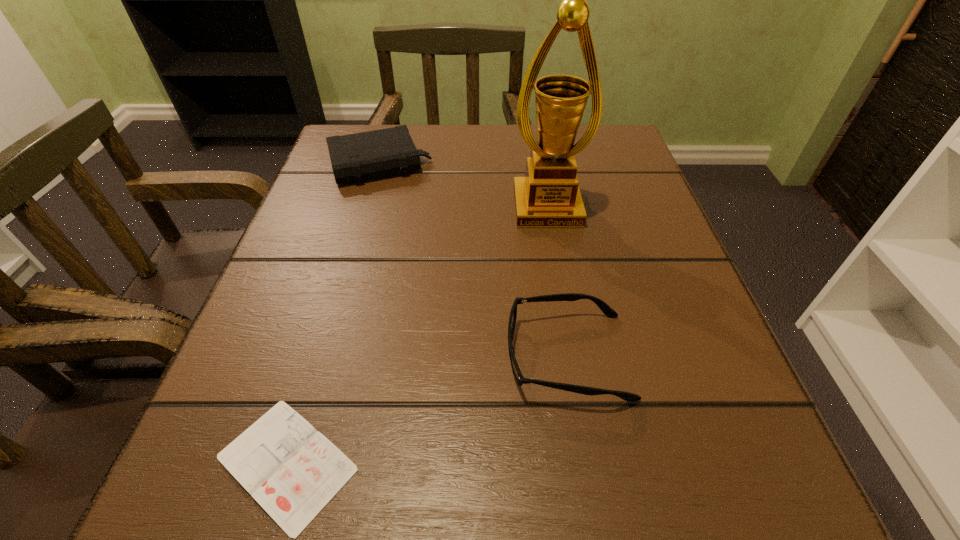
Identify the location of vacant point located between the spectacles and the Bible. (473, 260).

This screenshot has height=540, width=960. I want to click on vacant area that lies between the award and the spectacles, so click(x=557, y=282).

The image size is (960, 540). I want to click on vacant area between the Bible and the tallest object, so click(463, 186).

Locate an element on the screen. This screenshot has height=540, width=960. empty space between the spectacles and the tallest object is located at coordinates (557, 282).

The image size is (960, 540). In order to click on object that stands as the third closest to the award in this screenshot , I will do coord(293,471).

This screenshot has height=540, width=960. Find the location of `the closest object to the Bible`. the closest object to the Bible is located at coordinates (549, 196).

I want to click on blank area in the image that satisfies the following two spatial constraints: 1. on the front-facing side of the spectacles; 2. on the front side of the shortest object, so click(585, 463).

This screenshot has height=540, width=960. Identify the location of free point that satisfies the following two spatial constraints: 1. on the front-facing side of the tallest object; 2. on the front-facing side of the spectacles. (573, 356).

Find the location of `vacant region that satisfies the following two spatial constraints: 1. on the front-facing side of the award; 2. on the front-facing side of the spectacles`. vacant region that satisfies the following two spatial constraints: 1. on the front-facing side of the award; 2. on the front-facing side of the spectacles is located at coordinates (573, 356).

Find the location of `free location that satisfies the following two spatial constraints: 1. on the back side of the diary; 2. on the right side of the Bible`. free location that satisfies the following two spatial constraints: 1. on the back side of the diary; 2. on the right side of the Bible is located at coordinates (376, 164).